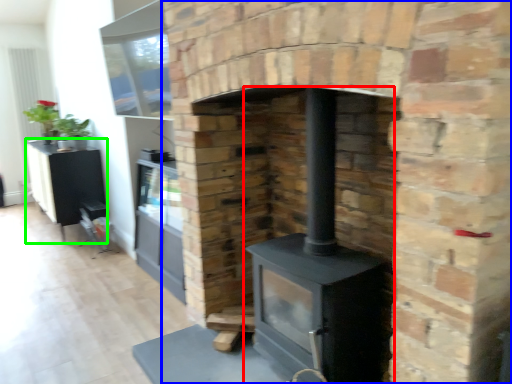
Question: Considering the real-world distances, which object is farthest from wood burning stove (highlighted by a red box)? fireplace (highlighted by a blue box) or entertainment center (highlighted by a green box)?

Choices:
 (A) fireplace
 (B) entertainment center

Answer: (B)